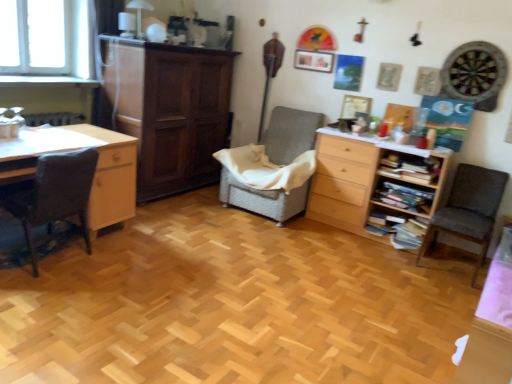
The width and height of the screenshot is (512, 384). I want to click on free point to the left of dark gray fabric chair at right, the first chair from the right, so click(x=397, y=261).